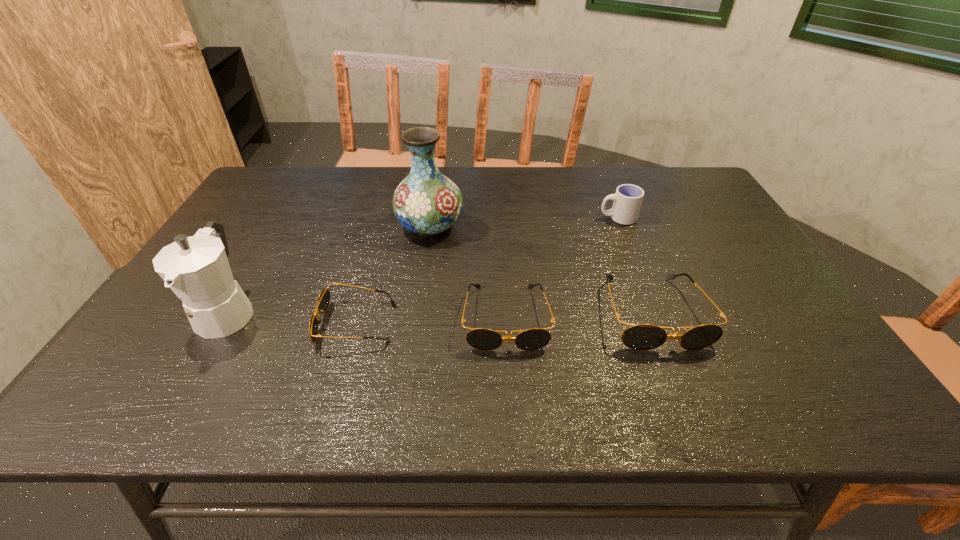
Where is `the shortest sunglasses`? This screenshot has height=540, width=960. the shortest sunglasses is located at coordinates (323, 301).

Where is `the shortest object`? Image resolution: width=960 pixels, height=540 pixels. the shortest object is located at coordinates (323, 301).

Identify the location of the fifth tallest object. (484, 339).

Find the location of `the fourth object from left to right`. the fourth object from left to right is located at coordinates (484, 339).

The image size is (960, 540). I want to click on the rightmost sunglasses, so click(x=642, y=337).

The image size is (960, 540). Find the location of `vase`. vase is located at coordinates (426, 202).

The image size is (960, 540). In order to click on cup in this screenshot , I will do `click(628, 198)`.

The width and height of the screenshot is (960, 540). Find the location of `coffeepot`. coffeepot is located at coordinates (196, 268).

The height and width of the screenshot is (540, 960). Find the location of `the second tallest object`. the second tallest object is located at coordinates point(196,268).

At what (x,y) coordinates should I click in order to perform the action: click on vacant space located 0.190m on the front-facing side of the leftmost sunglasses. Please return your answer as a coordinate pair (x, y). The height and width of the screenshot is (540, 960). Looking at the image, I should click on (238, 323).